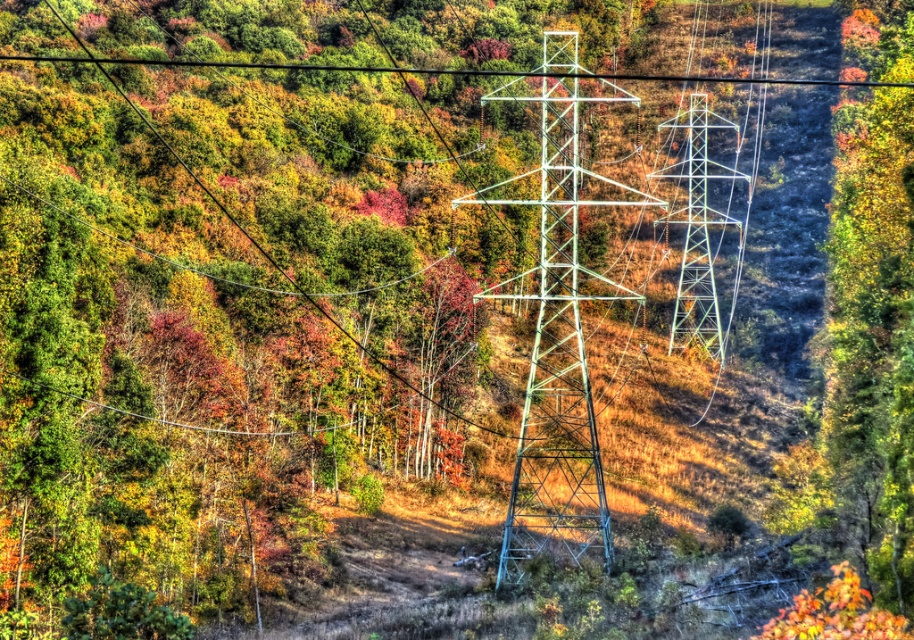
Can you confirm if green metallic tower at center is thinner than metallic silver tower at center?

No, green metallic tower at center is not thinner than metallic silver tower at center.

Between green metallic tower at center and metallic silver tower at center, which one appears on the left side from the viewer's perspective?

From the viewer's perspective, green metallic tower at center appears more on the left side.

Between point (571, 362) and point (715, 298), which one is positioned behind?

The point (715, 298) is more distant.

Locate an element on the screen. The height and width of the screenshot is (640, 914). green metallic tower at center is located at coordinates (558, 321).